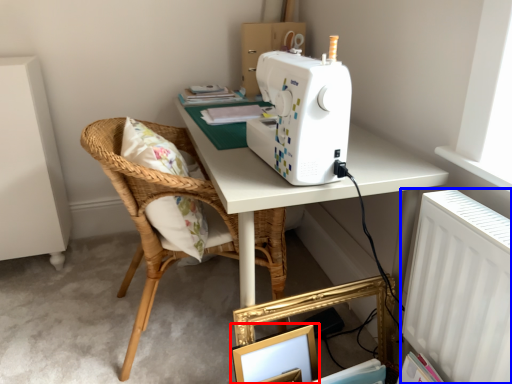
Question: Which object is further to the camera taking this photo, picture frame (highlighted by a red box) or radiator (highlighted by a blue box)?

Choices:
 (A) picture frame
 (B) radiator

Answer: (A)